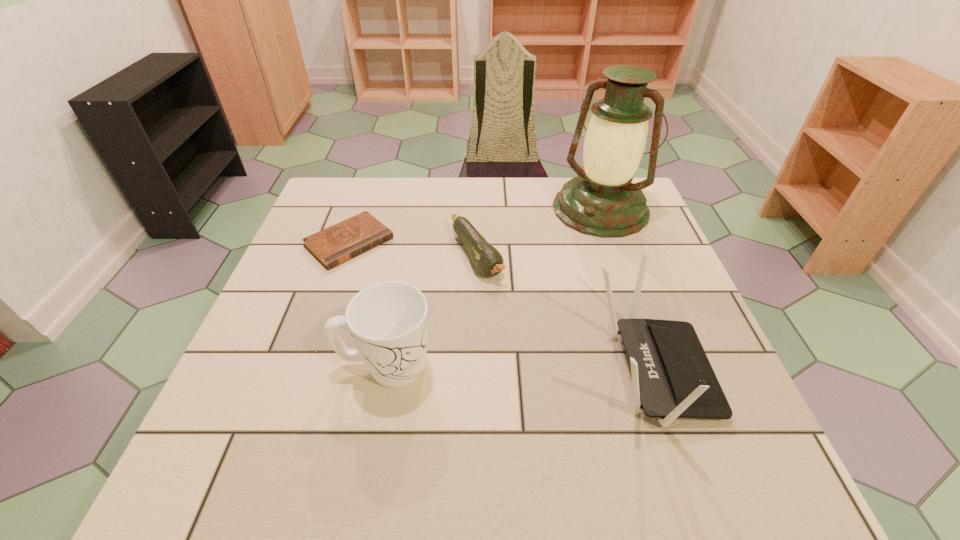
Find the location of a particular element. mug is located at coordinates (388, 321).

At what (x,y) coordinates should I click in order to perform the action: click on router. Please return your answer as a coordinate pair (x, y). The height and width of the screenshot is (540, 960). Looking at the image, I should click on (671, 375).

Find the location of a particular element. The width and height of the screenshot is (960, 540). the shortest object is located at coordinates (332, 246).

Locate an element on the screen. Image resolution: width=960 pixels, height=540 pixels. the third object from left to right is located at coordinates (488, 261).

Identify the location of the second shortest object. (488, 261).

I want to click on lantern, so click(602, 202).

Find the location of `blank area located 0.160m on the side of the mug with the handle`. blank area located 0.160m on the side of the mug with the handle is located at coordinates (516, 367).

Locate an element on the screen. vacant region located on the spine side of the shortest object is located at coordinates (404, 291).

Where is `blank space located on the spine side of the shortest object`? Image resolution: width=960 pixels, height=540 pixels. blank space located on the spine side of the shortest object is located at coordinates (444, 327).

Where is `vacant region located on the spine side of the shortest object`? The height and width of the screenshot is (540, 960). vacant region located on the spine side of the shortest object is located at coordinates (401, 288).